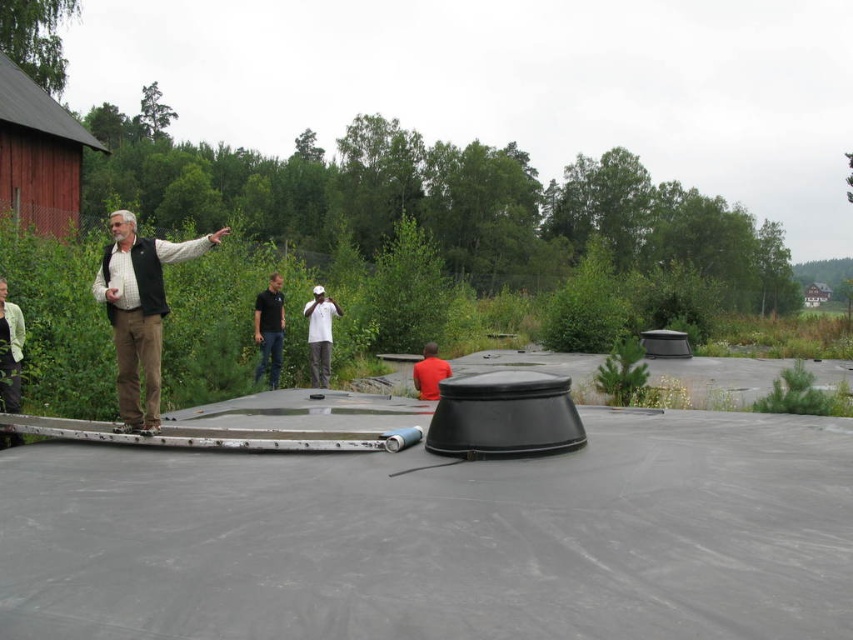
You are a photographer standing on the platform and want to take a photo of the red matte shirt at center and the white matte baseball cap at center so that both are clearly visible. Which object should be placed closer to the camera to ensure both are in focus?

The white matte baseball cap at center should be placed closer to the camera because the red matte shirt at center is behind it. By moving the white matte baseball cap at center forward, both objects can be within the same focal plane, ensuring both are in focus.

Consider the image. You are a photographer trying to capture a group photo of the dark blue shirt at center and the red matte shirt at center. Which person should you focus on first if you want to ensure both are in focus, considering their sizes?

The dark blue shirt at center is larger in size than the red matte shirt at center, so focusing on the larger one first would help ensure both are in focus.

You are a photographer positioned at the edge of the platform. You want to take a photo of the dark blue shirt at center and the red matte shirt at center. Which person should you focus on first to ensure both are in focus?

You should focus on the dark blue shirt at center first because it is closer to you than the red matte shirt at center. By focusing on the closer subject, both will be in focus as they are in the same focal plane.